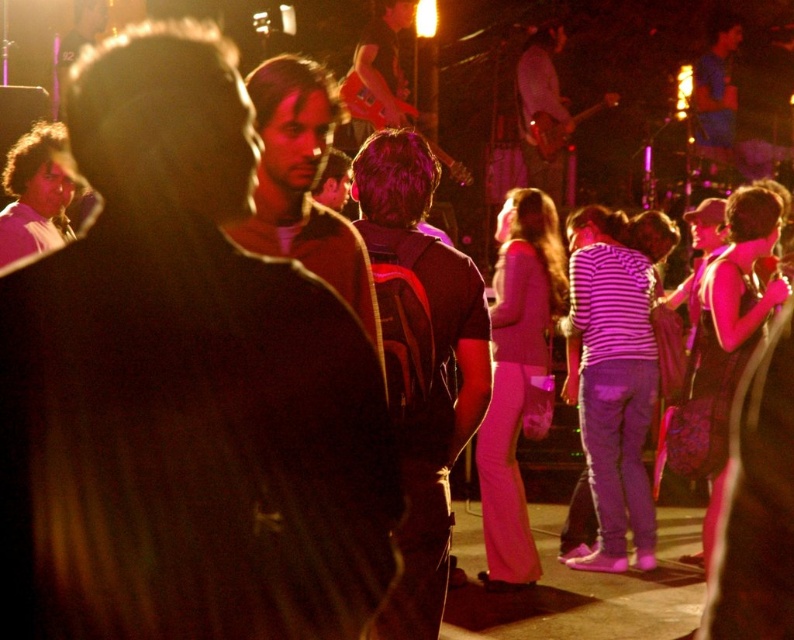
Between point (70, 500) and point (284, 77), which one is positioned behind?

Point (284, 77)

Locate an element on the screen. The image size is (794, 640). matte black shirt at center is located at coordinates (182, 387).

Is point (225, 326) positioned in front of point (438, 611)?

That is True.

What do you see at coordinates (182, 387) in the screenshot? I see `matte black shirt at center` at bounding box center [182, 387].

Between point (357, 426) and point (397, 317), which one is positioned in front?

Positioned in front is point (357, 426).

Find the location of a particular element. This screenshot has height=640, width=794. matte black shirt at center is located at coordinates (182, 387).

Who is taller, dark brown backpack at center or dark brown hair at center?

dark brown backpack at center

Is point (461, 397) positioned in front of point (359, 280)?

No, (461, 397) is behind (359, 280).

Identify the location of dark brown backpack at center. Image resolution: width=794 pixels, height=640 pixels. tap(421, 364).